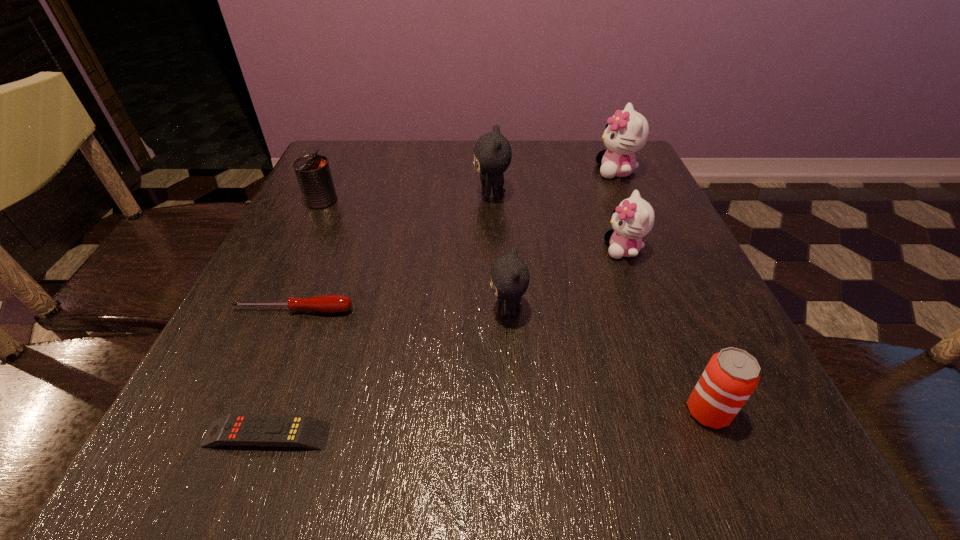
Where is `can that is at the left edge`? can that is at the left edge is located at coordinates (313, 173).

This screenshot has height=540, width=960. I want to click on screwdriver that is positioned at the left edge, so click(x=331, y=303).

Identify the location of remote control present at the left edge. This screenshot has height=540, width=960. (302, 431).

You are a GUI agent. You are given a task and a screenshot of the screen. Output one action in this format:
    pyautogui.click(x=<x>, y=<y>)
    Task: Click on the beer can that is at the right edge
    Image resolution: width=960 pixels, height=540 pixels.
    Given the screenshot: What is the action you would take?
    pyautogui.click(x=731, y=376)

Where is `object that is at the near left corner`? The image size is (960, 540). object that is at the near left corner is located at coordinates click(x=302, y=431).

Locate an element on the screen. Image resolution: width=960 pixels, height=540 pixels. object at the far right corner is located at coordinates (626, 132).

Where is `object at the near right corner`? object at the near right corner is located at coordinates (731, 376).

What are the coordinates of `blank space at the far edge of the desktop` in the screenshot? It's located at (455, 153).

I want to click on free space at the near edge of the desktop, so click(553, 466).

The height and width of the screenshot is (540, 960). In order to click on free space at the left edge of the desktop in this screenshot , I will do `click(319, 226)`.